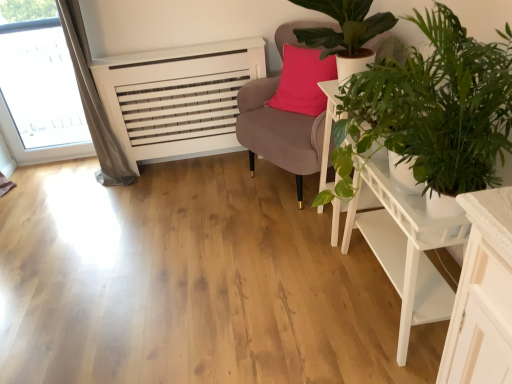
Where is `vacant space that's between velvet pink chair at upper right and white wooden table at lower right`? The image size is (512, 384). vacant space that's between velvet pink chair at upper right and white wooden table at lower right is located at coordinates (302, 252).